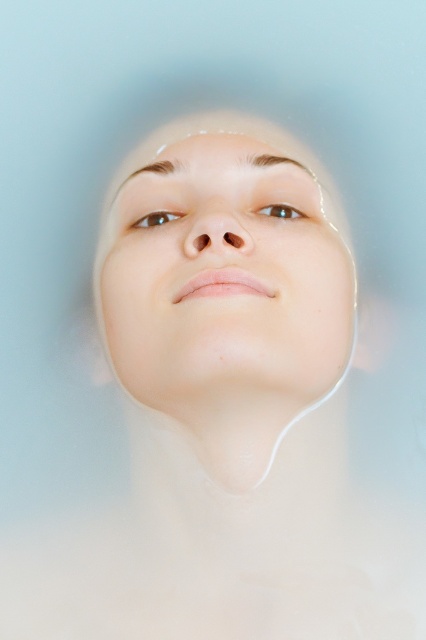
Does smooth skin face at center appear over brown matte eye at upper center?

Actually, smooth skin face at center is below brown matte eye at upper center.

You are a GUI agent. You are given a task and a screenshot of the screen. Output one action in this format:
    pyautogui.click(x=<x>, y=<y>)
    Task: Click on the smooth skin face at center
    The image size is (426, 640).
    Given the screenshot: What is the action you would take?
    pyautogui.click(x=224, y=280)

This screenshot has height=640, width=426. I want to click on smooth skin face at center, so click(x=224, y=280).

Between brown matte eye at upper center and brown glossy eye at center, which one has less height?

With less height is brown glossy eye at center.

What do you see at coordinates (155, 218) in the screenshot? I see `brown matte eye at upper center` at bounding box center [155, 218].

Image resolution: width=426 pixels, height=640 pixels. I want to click on brown matte eye at upper center, so click(x=155, y=218).

Does smooth skin face at center have a greater height compared to brown glossy eye at center?

Correct, smooth skin face at center is much taller as brown glossy eye at center.

Who is shorter, smooth skin face at center or brown glossy eye at center?

Standing shorter between the two is brown glossy eye at center.

You are a GUI agent. You are given a task and a screenshot of the screen. Output one action in this format:
    pyautogui.click(x=<x>, y=<y>)
    Task: Click on the smooth skin face at center
    
    Given the screenshot: What is the action you would take?
    pyautogui.click(x=224, y=280)